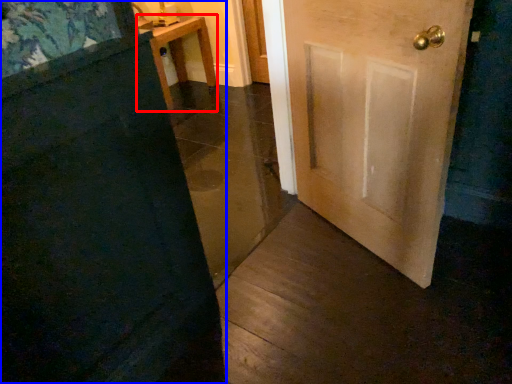
Question: Which object appears farthest to the camera in this image, furniture (highlighted by a red box) or door (highlighted by a blue box)?

Choices:
 (A) furniture
 (B) door

Answer: (A)